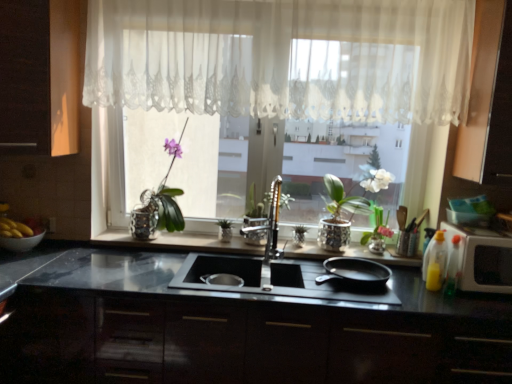
This screenshot has height=384, width=512. I want to click on free spot to the right of translucent plastic bottle at right, the second bottle in the right-to-left sequence, so click(x=475, y=297).